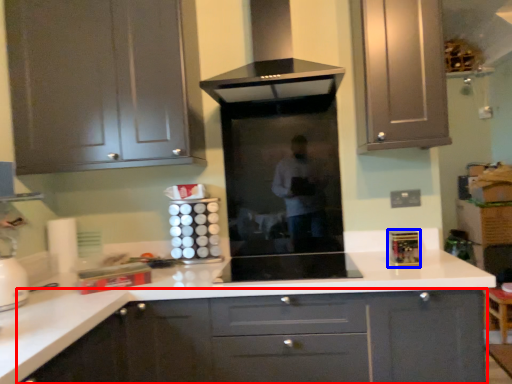
Question: Among these objects, which one is farthest to the camera, cabinetry (highlighted by a red box) or appliance (highlighted by a blue box)?

Choices:
 (A) cabinetry
 (B) appliance

Answer: (B)